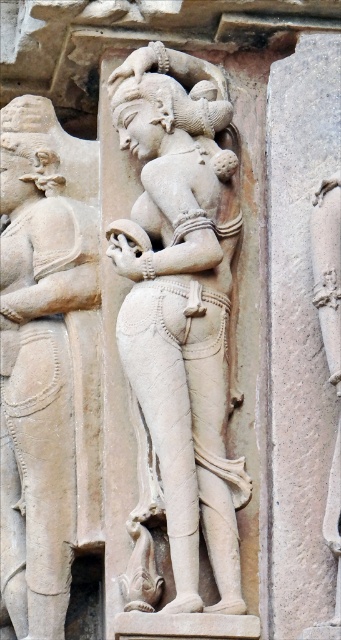
Question: Does stone statue at center have a larger size compared to smooth stone pillar at center?

Choices:
 (A) yes
 (B) no

Answer: (A)

Question: Which point is farther from the camera taking this photo?

Choices:
 (A) (188, 227)
 (B) (334, 390)

Answer: (A)

Question: Estimate the real-world distances between objects in this image. Which object is farther from the beige stone statue at left?

Choices:
 (A) smooth stone pillar at center
 (B) stone statue at center

Answer: (A)

Question: Does beige stone statue at left have a greater width compared to smooth stone pillar at center?

Choices:
 (A) no
 (B) yes

Answer: (B)

Question: Is stone statue at center positioned in front of beige stone statue at left?

Choices:
 (A) no
 (B) yes

Answer: (B)

Question: Among these objects, which one is nearest to the camera?

Choices:
 (A) beige stone statue at left
 (B) stone statue at center
 (C) smooth stone pillar at center

Answer: (B)